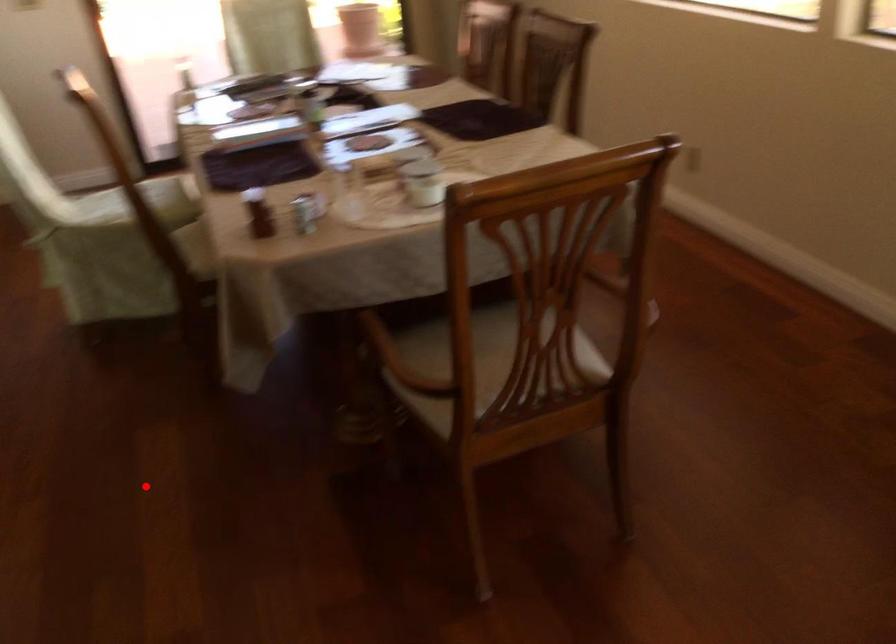
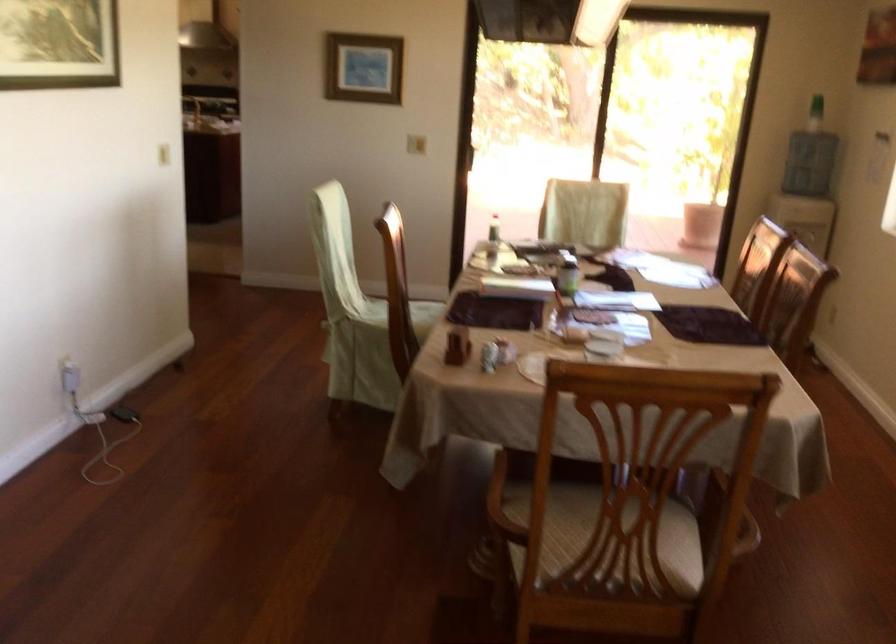
Locate, in the second image, the point that corresponds to the highlighted location in the first image.

(316, 540)